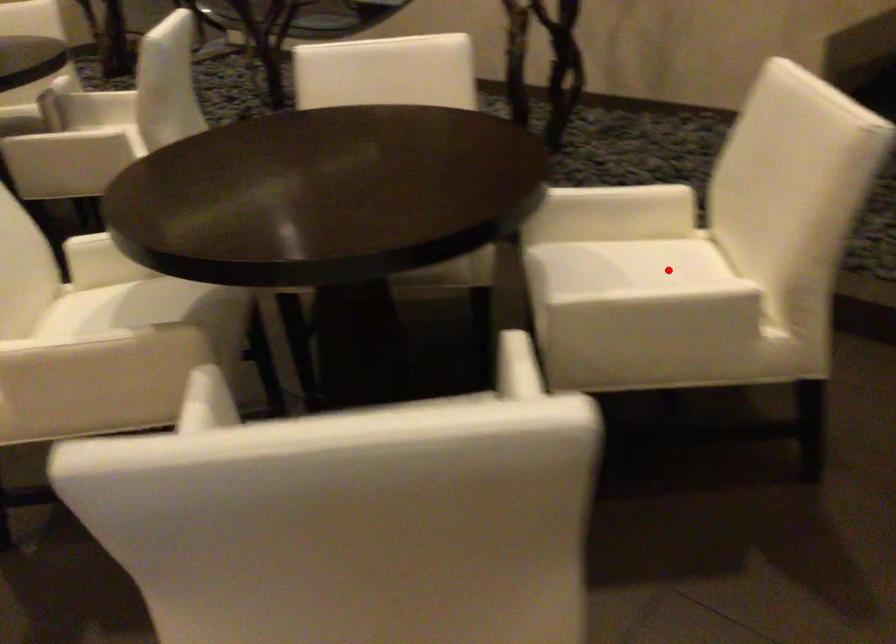
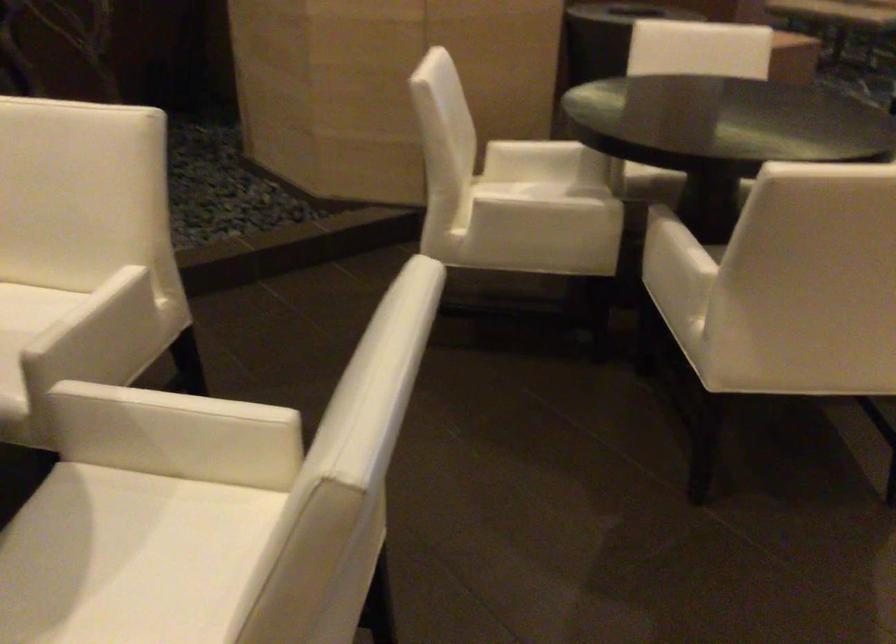
Find the pixel in the second image that matches the highlighted location in the first image.

(24, 308)